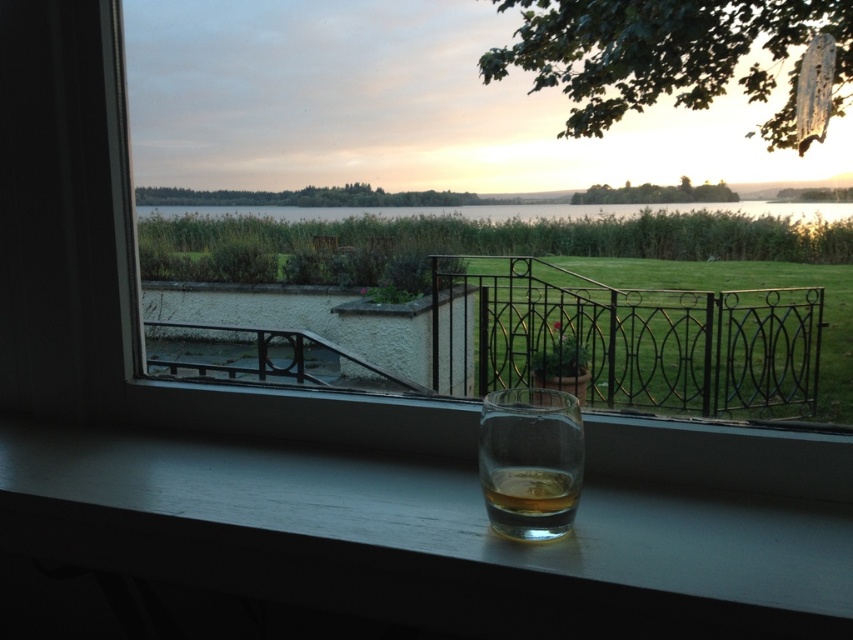
Identify the location of black wrought iron railing at center. Image resolution: width=853 pixels, height=640 pixels. (625, 339).

Based on the photo, which of these two, black wrought iron railing at center or green grass at lower center, stands shorter?

green grass at lower center is shorter.

The width and height of the screenshot is (853, 640). In order to click on black wrought iron railing at center in this screenshot , I will do `click(625, 339)`.

Where is `black wrought iron railing at center`? The width and height of the screenshot is (853, 640). black wrought iron railing at center is located at coordinates (625, 339).

How much distance is there between transparent glass at center and green grass at lower center?

transparent glass at center and green grass at lower center are 25.59 inches apart from each other.

Can you confirm if transparent glass at center is positioned to the right of green grass at lower center?

Indeed, transparent glass at center is positioned on the right side of green grass at lower center.

This screenshot has width=853, height=640. What are the coordinates of `transparent glass at center` in the screenshot? It's located at (492, 310).

In the scene shown: Is transparent glass at center wider than translucent glass at window?

Yes.

In order to click on transparent glass at center in this screenshot , I will do `click(492, 310)`.

Find the location of `transparent glass at center`. transparent glass at center is located at coordinates (492, 310).